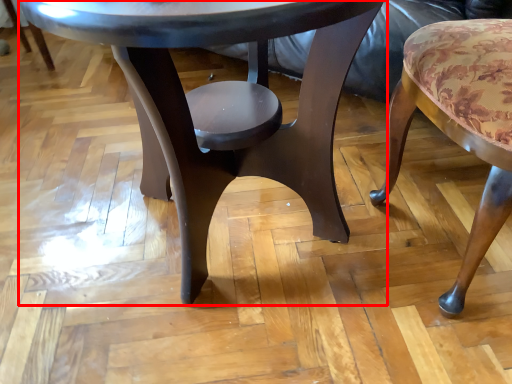
Question: From the image's perspective, considering the relative positions of coffee table (annotated by the red box) and chair in the image provided, where is coffee table (annotated by the red box) located with respect to the staircase?

Choices:
 (A) above
 (B) below

Answer: (A)